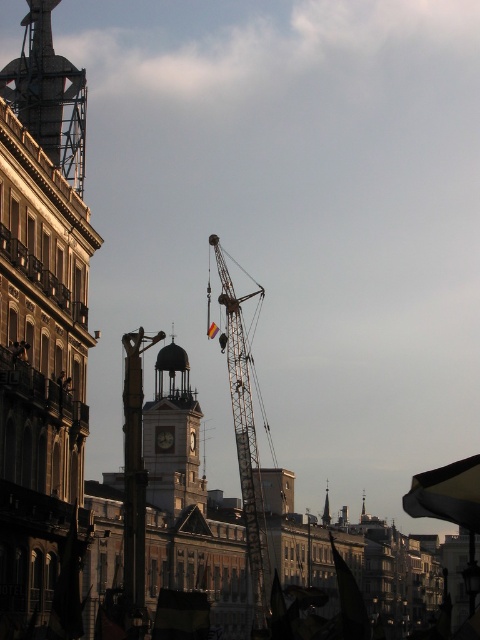
Question: Which object is positioned farthest from the metallic scaffolding at upper left?

Choices:
 (A) white glossy clock at center
 (B) metallic gray crane at center

Answer: (B)

Question: In this image, where is matte gray clock tower at center located relative to metallic gray crane at center?

Choices:
 (A) above
 (B) below

Answer: (B)

Question: Is metallic scaffolding at upper left behind matte gray clock tower at center?

Choices:
 (A) no
 (B) yes

Answer: (A)

Question: Which object appears closest to the camera in this image?

Choices:
 (A) metallic gray crane at center
 (B) matte gray clock tower at center

Answer: (B)

Question: Estimate the real-world distances between objects in this image. Which object is farther from the white glossy clock at center?

Choices:
 (A) metallic scaffolding at upper left
 (B) metallic gray crane at center

Answer: (A)

Question: Is matte gray clock tower at center in front of white glossy clock at center?

Choices:
 (A) yes
 (B) no

Answer: (A)